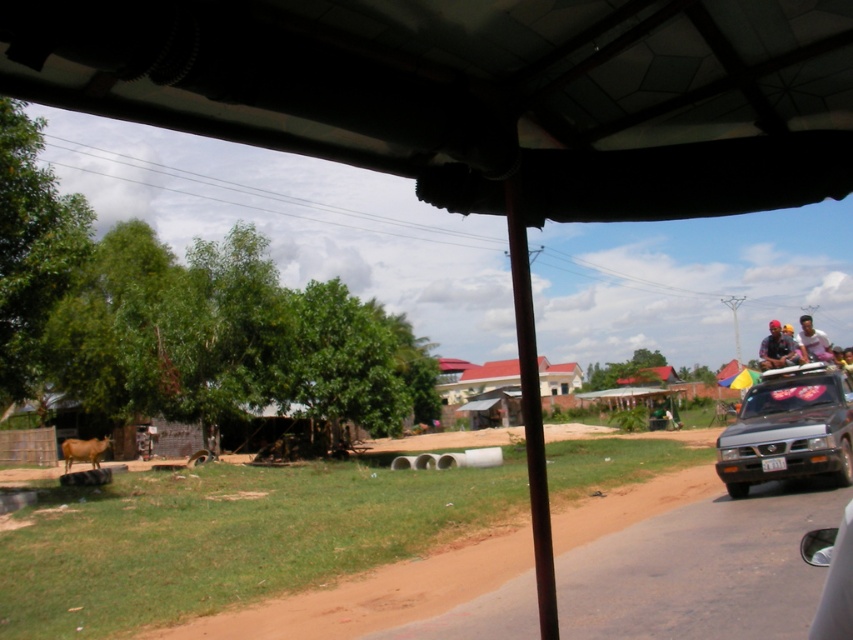
Does point (747, 19) come behind point (814, 556)?

That is False.

Can you confirm if transparent plastic canopy at upper center is bigger than transparent glass car window at lower right?

No, transparent plastic canopy at upper center is not bigger than transparent glass car window at lower right.

Does point (344, 129) come closer to viewer compared to point (805, 532)?

Yes, point (344, 129) is in front of point (805, 532).

Where is `transparent plastic canopy at upper center`? transparent plastic canopy at upper center is located at coordinates (479, 92).

This screenshot has width=853, height=640. Describe the element at coordinates (473, 381) in the screenshot. I see `red corrugated metal hut at center` at that location.

Locate an element on the screen. red corrugated metal hut at center is located at coordinates (473, 381).

Who is more distant from viewer, (766,419) or (566,381)?

The point (566,381) is more distant.

Can you confirm if silver metallic jeep at right is positioned below red corrugated metal hut at center?

No, silver metallic jeep at right is not below red corrugated metal hut at center.

Locate an element on the screen. The width and height of the screenshot is (853, 640). silver metallic jeep at right is located at coordinates (788, 429).

I want to click on silver metallic jeep at right, so click(x=788, y=429).